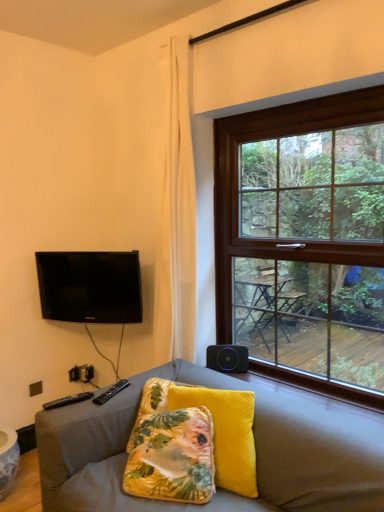
Question: From a real-world perspective, is velvet yellow pillow at center located higher than black glossy tv at upper left?

Choices:
 (A) yes
 (B) no

Answer: (B)

Question: Is velvet yellow pillow at center smaller than black glossy tv at upper left?

Choices:
 (A) no
 (B) yes

Answer: (A)

Question: Is velvet yellow pillow at center to the right of black glossy tv at upper left from the viewer's perspective?

Choices:
 (A) yes
 (B) no

Answer: (A)

Question: Can you confirm if velvet yellow pillow at center is wider than black glossy tv at upper left?

Choices:
 (A) yes
 (B) no

Answer: (A)

Question: From the image's perspective, would you say velvet yellow pillow at center is shown under black glossy tv at upper left?

Choices:
 (A) no
 (B) yes

Answer: (B)

Question: Does velvet yellow pillow at center touch black glossy tv at upper left?

Choices:
 (A) yes
 (B) no

Answer: (B)

Question: Is the depth of brown wooden window at upper right less than that of black matte speaker at lower right?

Choices:
 (A) yes
 (B) no

Answer: (A)

Question: Is the position of brown wooden window at upper right more distant than that of black matte speaker at lower right?

Choices:
 (A) yes
 (B) no

Answer: (B)

Question: From the image's perspective, would you say brown wooden window at upper right is shown under black matte speaker at lower right?

Choices:
 (A) no
 (B) yes

Answer: (A)

Question: Is brown wooden window at upper right not close to black matte speaker at lower right?

Choices:
 (A) no
 (B) yes

Answer: (A)

Question: Considering the relative sizes of brown wooden window at upper right and black matte speaker at lower right in the image provided, is brown wooden window at upper right taller than black matte speaker at lower right?

Choices:
 (A) no
 (B) yes

Answer: (B)

Question: From a real-world perspective, is brown wooden window at upper right over black matte speaker at lower right?

Choices:
 (A) yes
 (B) no

Answer: (A)

Question: Is brown wooden window at upper right positioned beyond the bounds of black glossy tv at upper left?

Choices:
 (A) yes
 (B) no

Answer: (A)